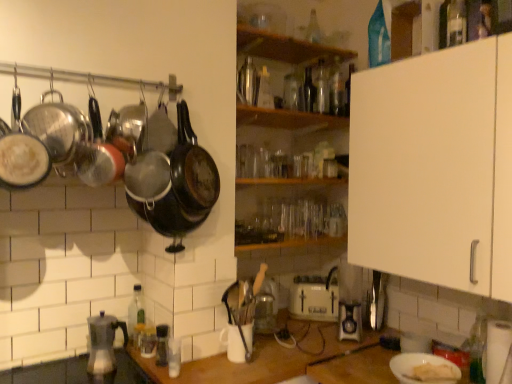
Question: From the image's perspective, is wooden shelf at center, the first shelf ordered from the bottom, beneath white matte counter top at center?

Choices:
 (A) no
 (B) yes

Answer: (A)

Question: Can you confirm if wooden shelf at center, the first shelf ordered from the bottom, is smaller than white matte counter top at center?

Choices:
 (A) yes
 (B) no

Answer: (A)

Question: Considering the relative positions of wooden shelf at center, the 2th shelf viewed from the top, and white matte counter top at center in the image provided, is wooden shelf at center, the 2th shelf viewed from the top, behind white matte counter top at center?

Choices:
 (A) no
 (B) yes

Answer: (B)

Question: Considering the relative positions of wooden shelf at center, the 2th shelf viewed from the top, and white matte counter top at center in the image provided, is wooden shelf at center, the 2th shelf viewed from the top, in front of white matte counter top at center?

Choices:
 (A) no
 (B) yes

Answer: (A)

Question: From the image's perspective, does wooden shelf at center, the 2th shelf viewed from the top, appear higher than white matte counter top at center?

Choices:
 (A) yes
 (B) no

Answer: (A)

Question: Is black matte wok at left, the first wok in the right-to-left sequence, inside the boundaries of transparent glass bottle at upper center, which is the second bottle from back to front, or outside?

Choices:
 (A) outside
 (B) inside

Answer: (A)

Question: Looking at the image, does black matte wok at left, which is the sixth wok from left to right, seem bigger or smaller compared to transparent glass bottle at upper center, which is the second bottle from back to front?

Choices:
 (A) big
 (B) small

Answer: (A)

Question: From a real-world perspective, is black matte wok at left, which is the sixth wok from left to right, above or below transparent glass bottle at upper center, which is the second bottle from back to front?

Choices:
 (A) above
 (B) below

Answer: (B)

Question: From the image's perspective, is black matte wok at left, the first wok in the right-to-left sequence, positioned above or below transparent glass bottle at upper center, the eighth bottle in the front-to-back sequence?

Choices:
 (A) below
 (B) above

Answer: (A)

Question: From the image's perspective, is transparent glass bottle at upper center, which appears as the seventh bottle when viewed from the right, located above or below wooden shelf at upper center, positioned as the second shelf in bottom-to-top order?

Choices:
 (A) below
 (B) above

Answer: (A)

Question: Relative to wooden shelf at upper center, marked as the first shelf in a top-to-bottom arrangement, is transparent glass bottle at upper center, the 4th bottle from the front, in front or behind?

Choices:
 (A) behind
 (B) front

Answer: (A)

Question: From a real-world perspective, is transparent glass bottle at upper center, the 4th bottle from the front, positioned above or below wooden shelf at upper center, marked as the first shelf in a top-to-bottom arrangement?

Choices:
 (A) above
 (B) below

Answer: (B)

Question: Does point (291, 84) appear closer or farther from the camera than point (298, 56)?

Choices:
 (A) farther
 (B) closer

Answer: (A)

Question: Based on their positions, is transparent glass bottle at upper center, which is the 2th bottle from right to left, located to the left or right of black matte wok at upper center, acting as the third wok starting from the left?

Choices:
 (A) right
 (B) left

Answer: (A)

Question: Is point (350, 72) positioned closer to the camera than point (148, 173)?

Choices:
 (A) closer
 (B) farther

Answer: (B)